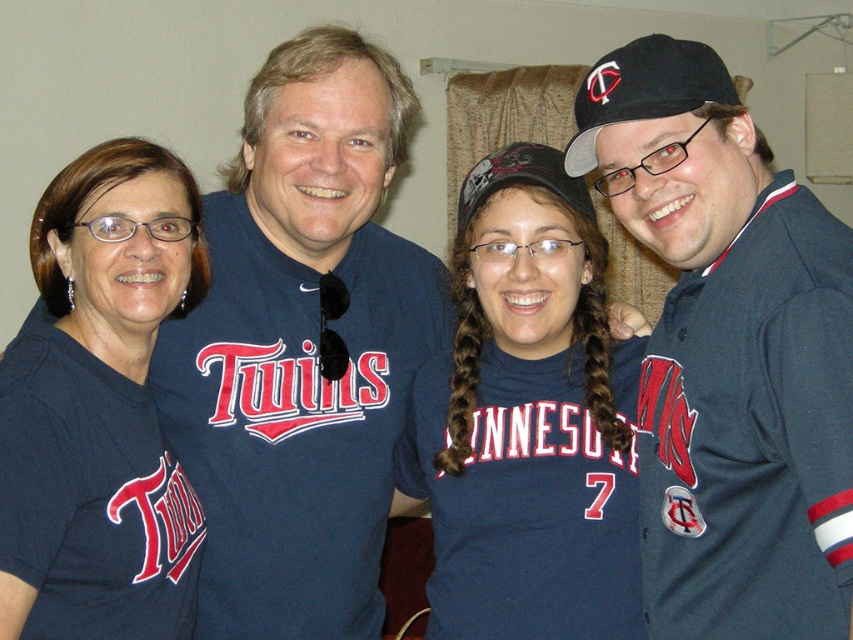
Can you confirm if blue jersey at right is thinner than navy blue jersey at center?

Indeed, blue jersey at right has a lesser width compared to navy blue jersey at center.

Is point (669, 397) positioned after point (276, 432)?

No, (669, 397) is closer to viewer.

The height and width of the screenshot is (640, 853). I want to click on blue jersey at right, so 729,355.

Between matte blue shirt at left and black fabric baseball cap at right, which one is positioned lower?

matte blue shirt at left

Consider the image. Does matte blue shirt at left appear on the left side of black fabric baseball cap at right?

Indeed, matte blue shirt at left is positioned on the left side of black fabric baseball cap at right.

Identify the location of matte blue shirt at left. (94, 384).

The height and width of the screenshot is (640, 853). Identify the location of matte blue shirt at left. (94, 384).

Does blue matte jersey at center have a greater height compared to matte blue shirt at left?

Correct, blue matte jersey at center is much taller as matte blue shirt at left.

Can you confirm if blue matte jersey at center is positioned to the right of matte blue shirt at left?

Yes, blue matte jersey at center is to the right of matte blue shirt at left.

Is point (521, 236) in front of point (184, 266)?

No.

Locate an element on the screen. The height and width of the screenshot is (640, 853). blue matte jersey at center is located at coordinates (527, 420).